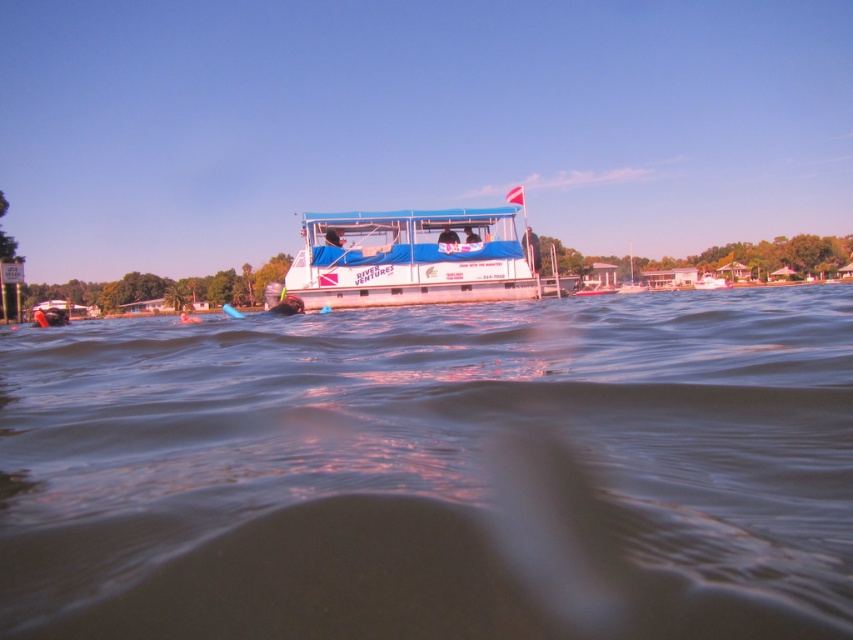
Who is lower down, blue rubber ring at upper center or matte black wetsuit at center?

blue rubber ring at upper center

Does point (440, 243) come closer to viewer compared to point (463, 232)?

That is True.

Identify the location of blue rubber ring at upper center. (447, 236).

Between clear water at center and white plastic boat at center, which one appears on the right side from the viewer's perspective?

Positioned to the right is white plastic boat at center.

Who is lower down, clear water at center or white plastic boat at center?

Positioned lower is clear water at center.

I want to click on clear water at center, so click(x=436, y=472).

I want to click on clear water at center, so click(x=436, y=472).

Can you confirm if clear water at center is smaller than blue rubber ring at upper center?

No.

Does point (358, 611) come farther from viewer compared to point (438, 236)?

No, (358, 611) is in front of (438, 236).

Locate an element on the screen. The height and width of the screenshot is (640, 853). clear water at center is located at coordinates (436, 472).